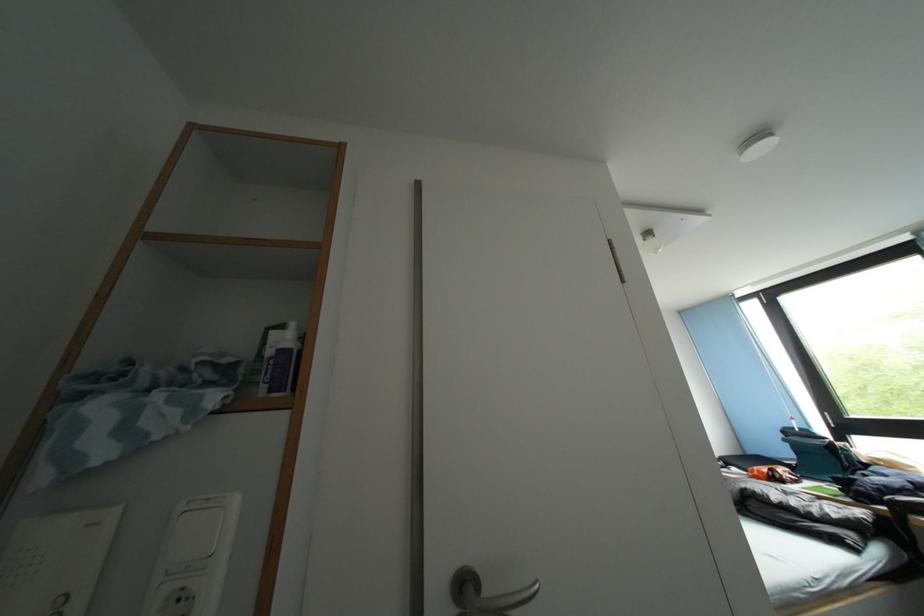
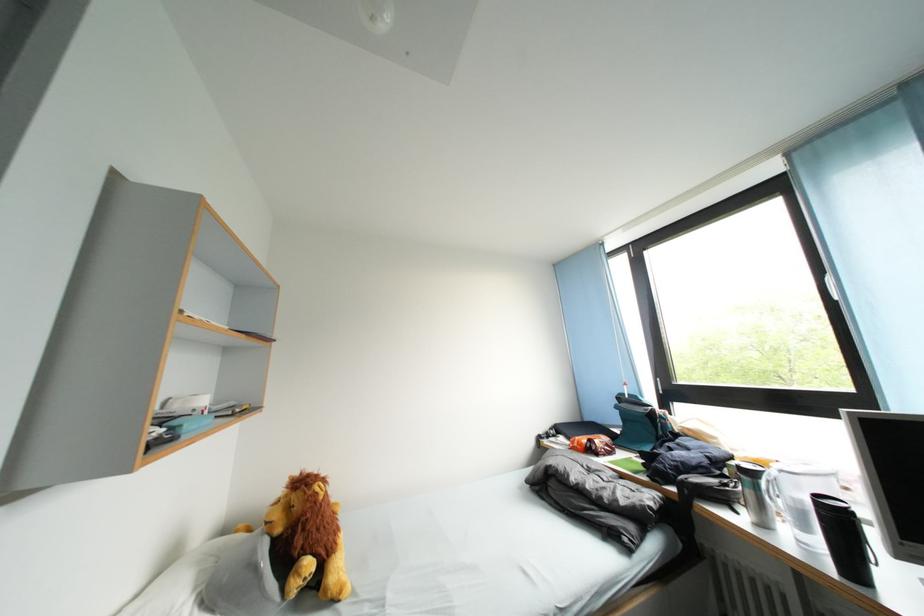
Locate, in the second image, the point that corresponds to point (822, 516) in the first image.

(614, 501)